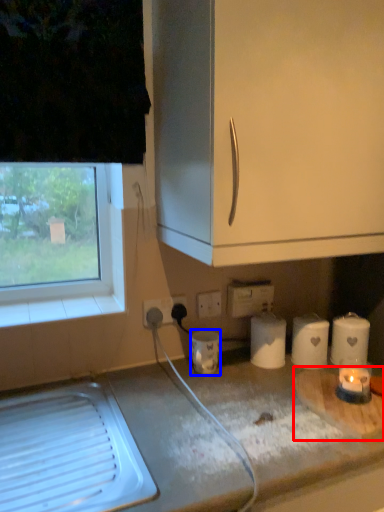
Question: Which of the following is the farthest to the observer, cutting board (highlighted by a red box) or appliance (highlighted by a blue box)?

Choices:
 (A) cutting board
 (B) appliance

Answer: (B)